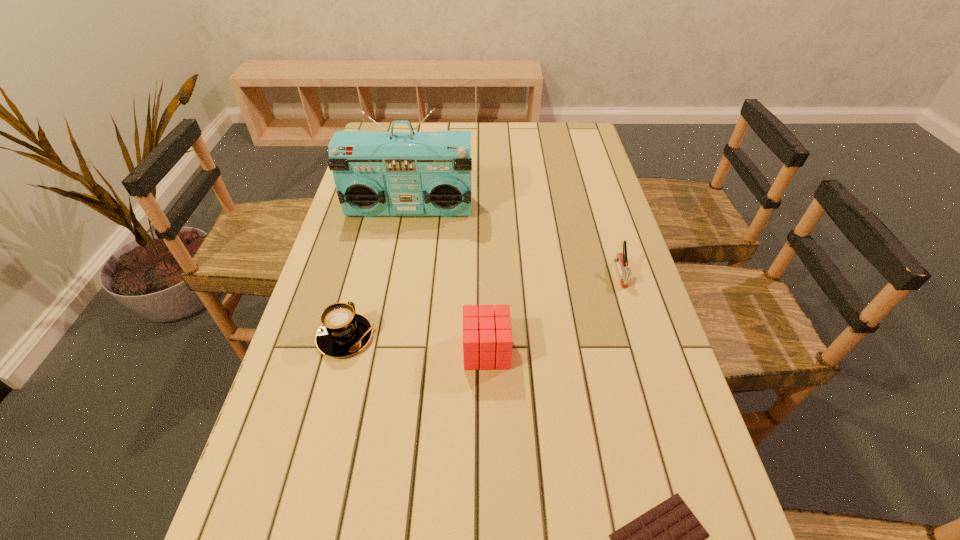
Identify the location of blank region between the stapler and the cube. (553, 312).

Where is `the fourth closest object relative to the cube`? The height and width of the screenshot is (540, 960). the fourth closest object relative to the cube is located at coordinates (412, 173).

Locate an element on the screen. This screenshot has width=960, height=540. the third closest object to the cube is located at coordinates (621, 260).

The image size is (960, 540). I want to click on blank area in the image that satisfies the following two spatial constraints: 1. on the front-facing side of the tallest object; 2. on the right side of the cube, so [385, 351].

Identify the location of vacant space that satisfies the following two spatial constraints: 1. on the front-facing side of the cube; 2. on the left side of the radio receiver. The width and height of the screenshot is (960, 540). (385, 351).